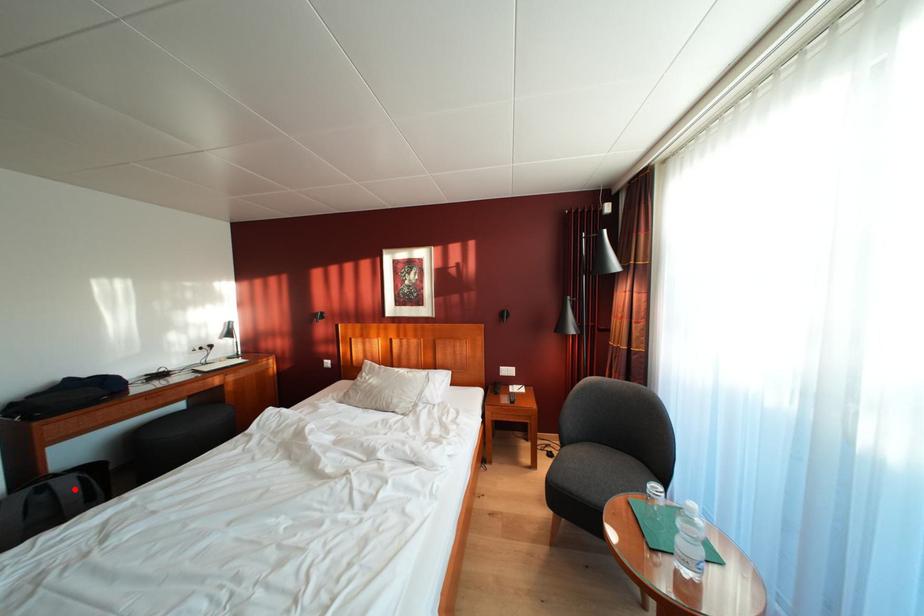
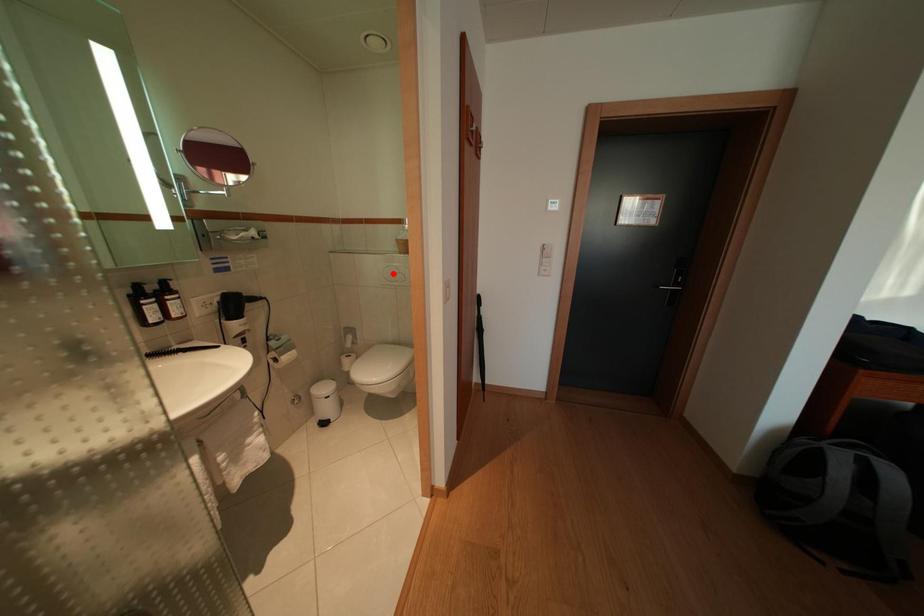
I am providing you with two images of the same scene from different viewpoints. A red point is marked on the first image and another point is marked on the second image. Is the marked point in image1 the same physical position as the marked point in image2?

No